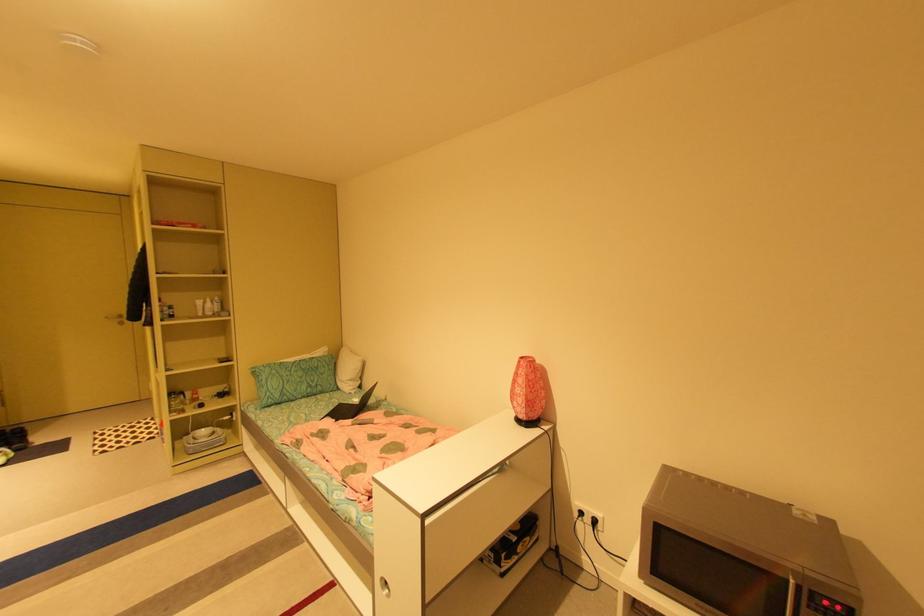
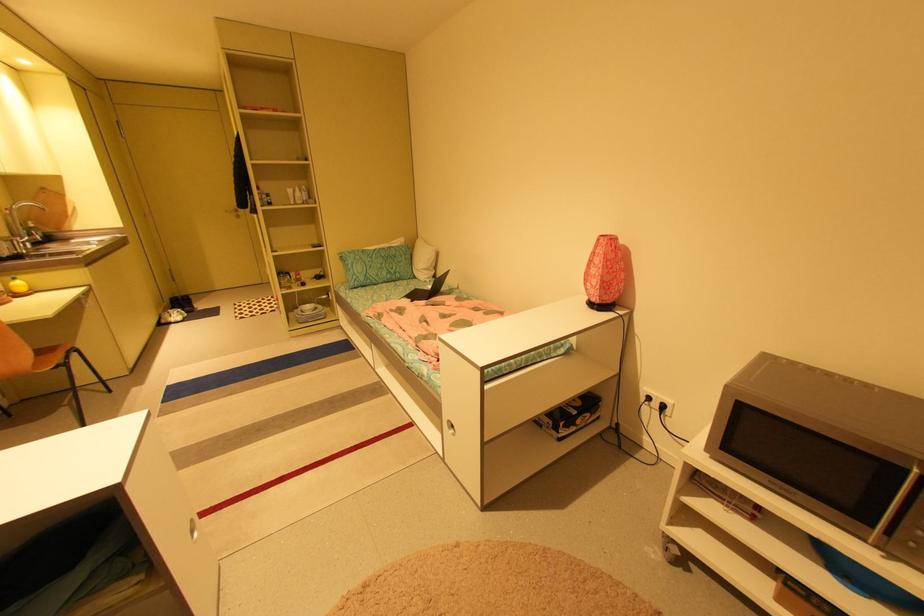
Locate, in the second image, the point that corresponds to pixel 386 589 in the first image.

(454, 429)